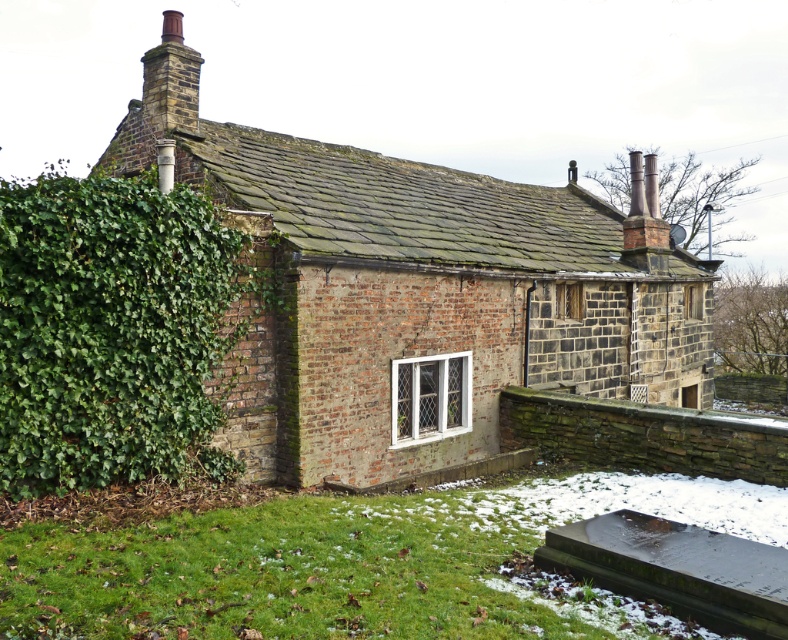
Question: From the image, what is the correct spatial relationship of brown brick cottage at center in relation to green leafy hedge at left?

Choices:
 (A) left
 (B) right

Answer: (B)

Question: Which point is closer to the camera?

Choices:
 (A) (281, 467)
 (B) (49, 276)

Answer: (B)

Question: Which point is farther to the camera?

Choices:
 (A) brown brick cottage at center
 (B) green leafy hedge at left

Answer: (A)

Question: Considering the relative positions of brown brick cottage at center and green leafy hedge at left in the image provided, where is brown brick cottage at center located with respect to green leafy hedge at left?

Choices:
 (A) left
 (B) right

Answer: (B)

Question: Can you confirm if brown brick cottage at center is positioned below green leafy hedge at left?

Choices:
 (A) yes
 (B) no

Answer: (B)

Question: Among these points, which one is nearest to the camera?

Choices:
 (A) (504, 189)
 (B) (32, 454)

Answer: (B)